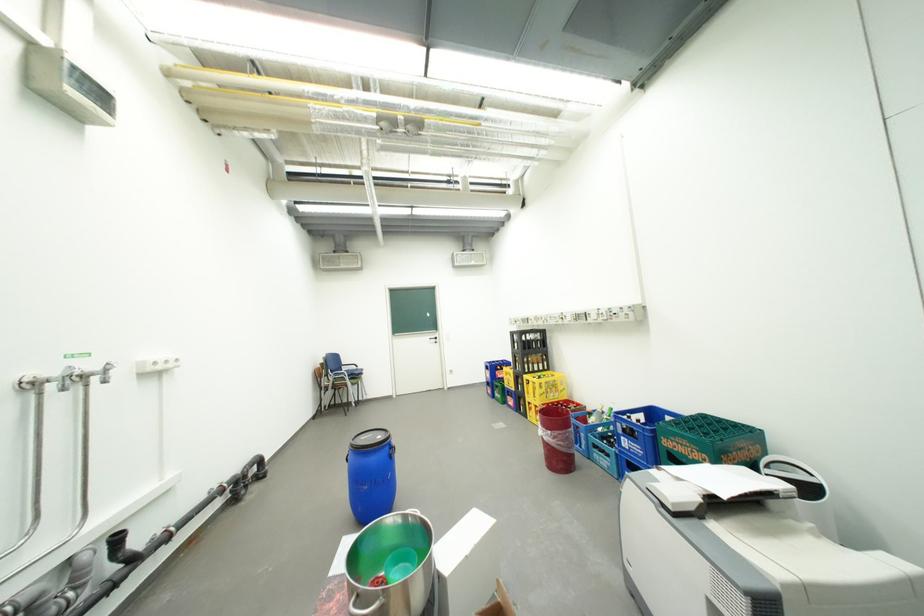
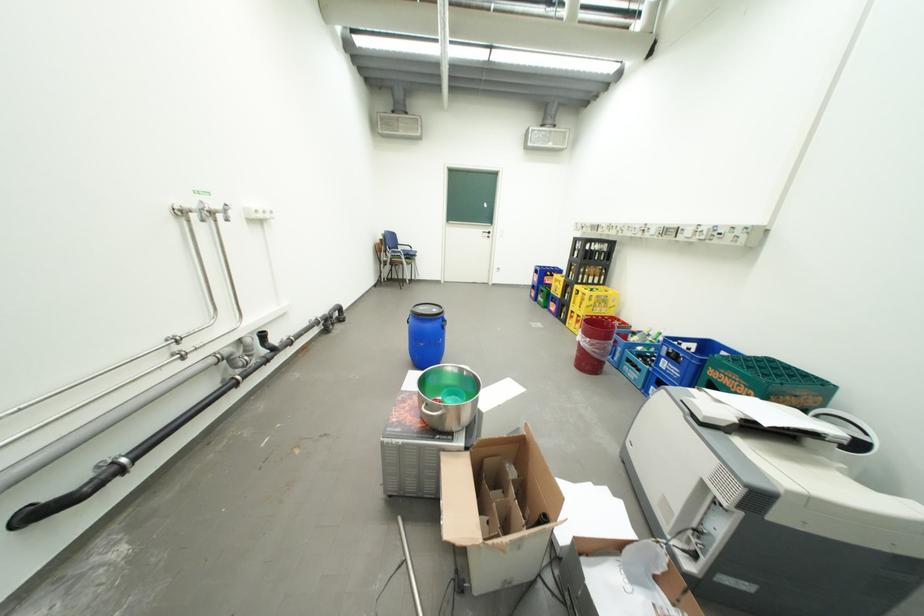
The point at (369, 439) is marked in the first image. Where is the corresponding point in the second image?

(428, 309)